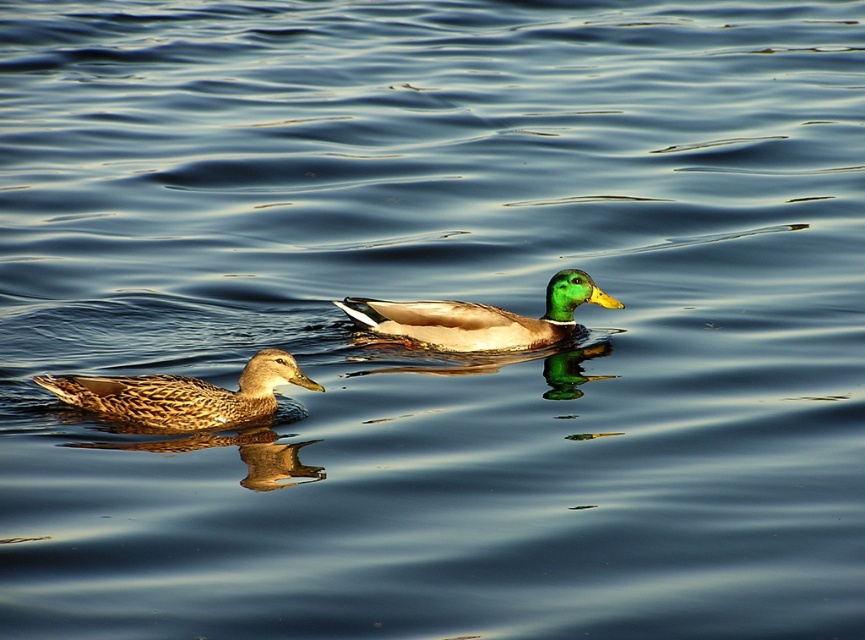
Question: Is brown speckled feathers at left to the left of green glossy duck at center from the viewer's perspective?

Choices:
 (A) no
 (B) yes

Answer: (B)

Question: Which point is farther to the camera?

Choices:
 (A) brown speckled feathers at left
 (B) green glossy duck at center

Answer: (B)

Question: Is brown speckled feathers at left wider than green glossy duck at center?

Choices:
 (A) no
 (B) yes

Answer: (A)

Question: Does brown speckled feathers at left appear on the left side of green glossy duck at center?

Choices:
 (A) yes
 (B) no

Answer: (A)